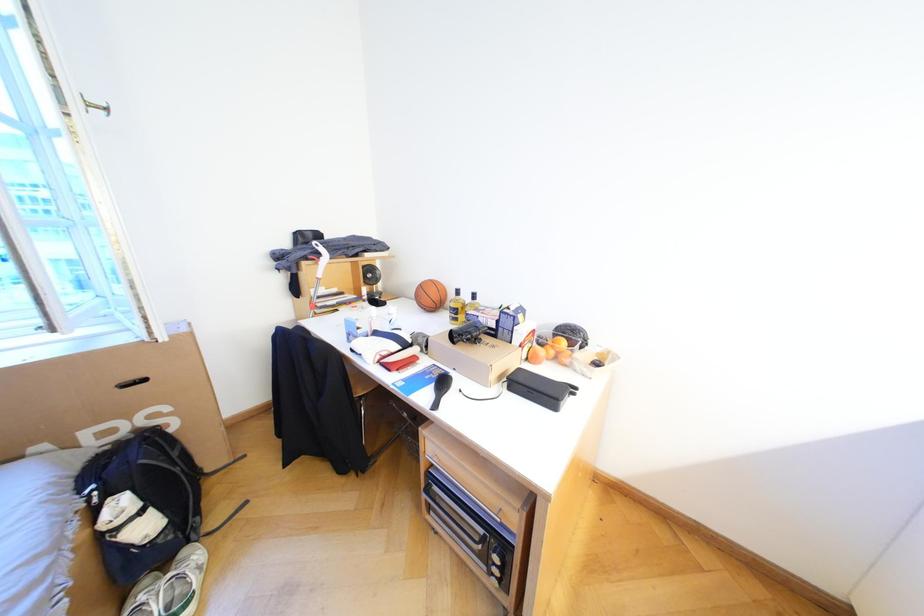
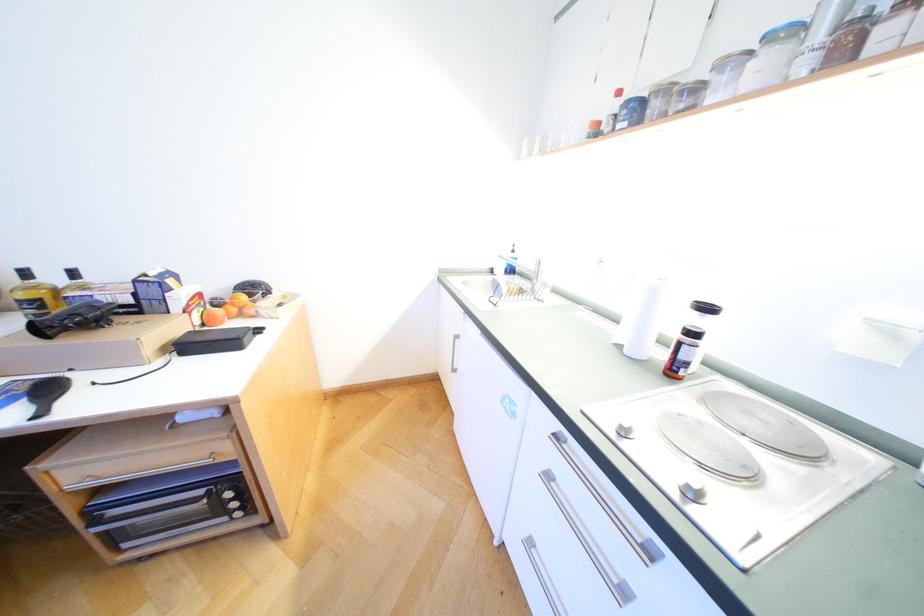
Question: The camera is either moving clockwise (left) or counter-clockwise (right) around the object. The first image is from the beginning of the video and the second image is from the end. Is the camera moving left or right when shooting the video?

Choices:
 (A) Left
 (B) Right

Answer: (A)